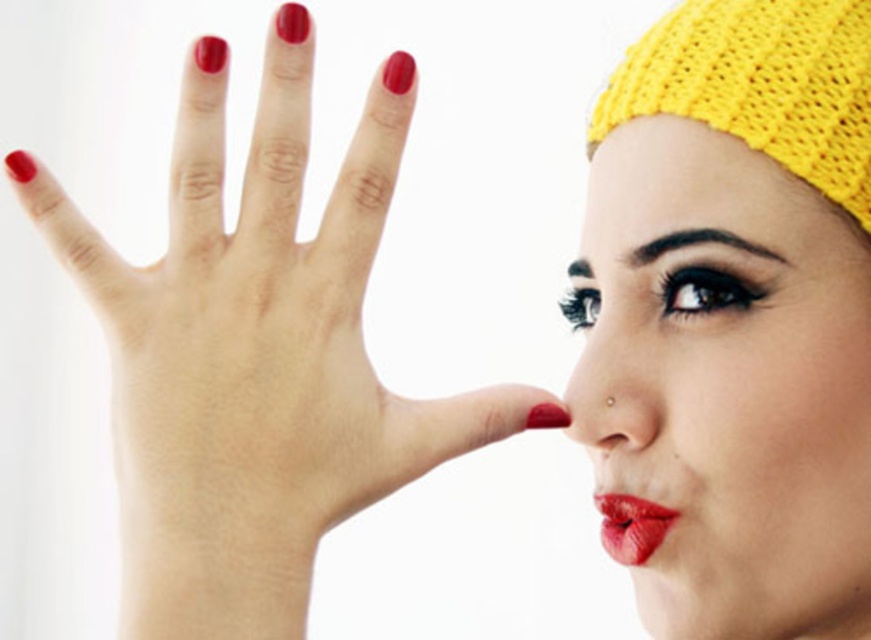
Question: Which object is positioned farthest from the matte red nails at center?

Choices:
 (A) glossy matte lips at center
 (B) yellow knitted headband at upper right
 (C) matte gold nose at center
 (D) knitted yellow hat at upper right

Answer: (D)

Question: Which point appears closest to the camera in this image?

Choices:
 (A) (618, 344)
 (B) (284, 266)
 (C) (861, 570)

Answer: (B)

Question: Is knitted yellow hat at upper right smaller than matte gold nose at center?

Choices:
 (A) yes
 (B) no

Answer: (B)

Question: Can you confirm if knitted yellow hat at upper right is positioned to the right of matte gold nose at center?

Choices:
 (A) no
 (B) yes

Answer: (B)

Question: Does matte red nails at center have a larger size compared to matte gold nose at center?

Choices:
 (A) no
 (B) yes

Answer: (B)

Question: Which point appears farthest from the camera in this image?

Choices:
 (A) (761, 564)
 (B) (626, 515)

Answer: (B)